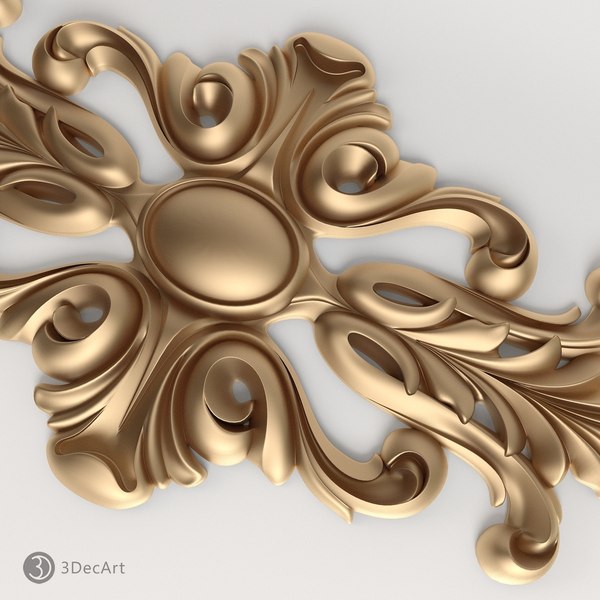
Identify the location of center oval in wall art. Image resolution: width=600 pixels, height=600 pixels. (171, 217).